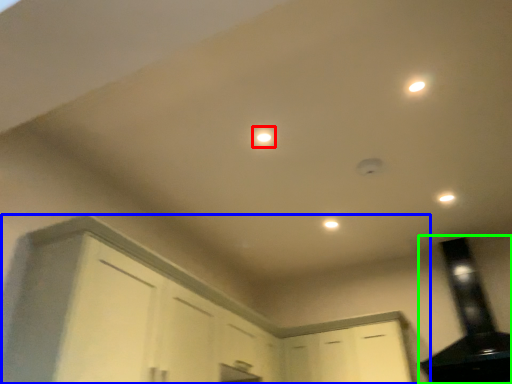
Question: Estimate the real-world distances between objects in this image. Which object is closer to light (highlighted by a red box), cabinetry (highlighted by a blue box) or exhaust hood (highlighted by a green box)?

Choices:
 (A) cabinetry
 (B) exhaust hood

Answer: (A)